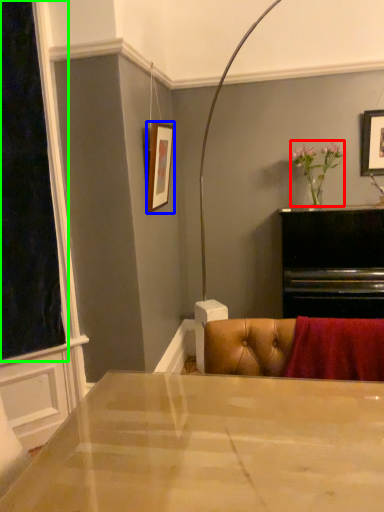
Question: Which object is positioned closest to floral arrangement (highlighted by a red box)? Select from picture frame (highlighted by a blue box) and window screen (highlighted by a green box).

Choices:
 (A) picture frame
 (B) window screen

Answer: (A)